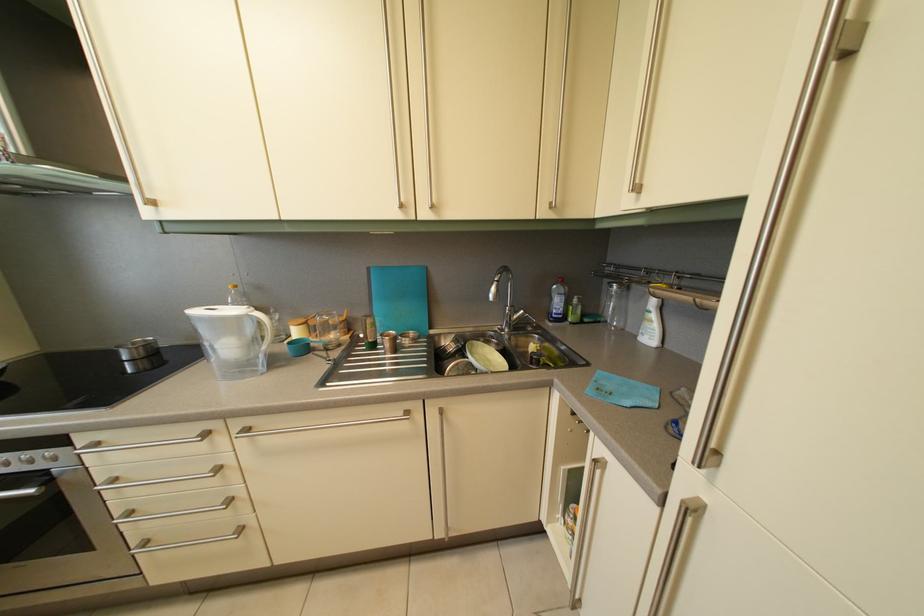
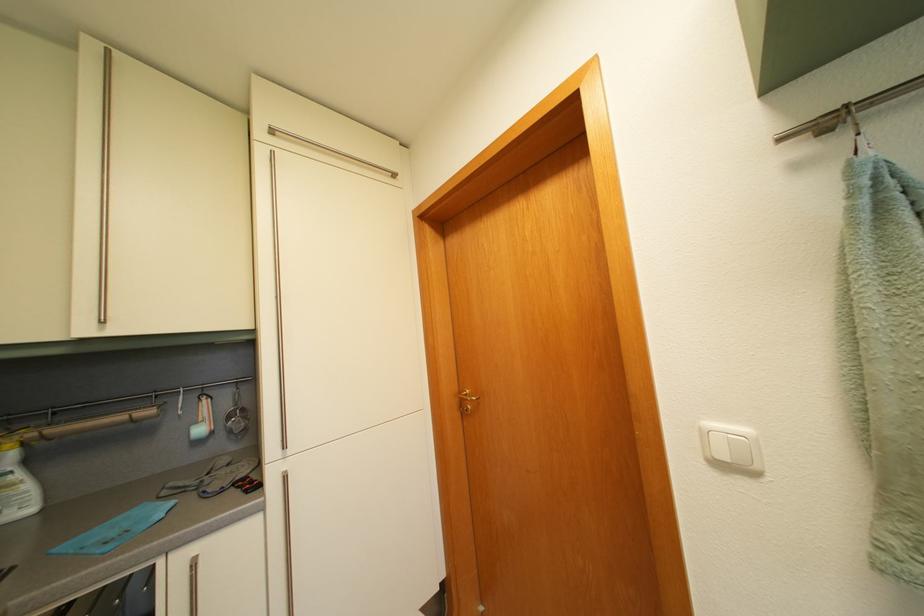
Where in the second image is the point corresponding to point 662,323 from the first image?

(26, 484)